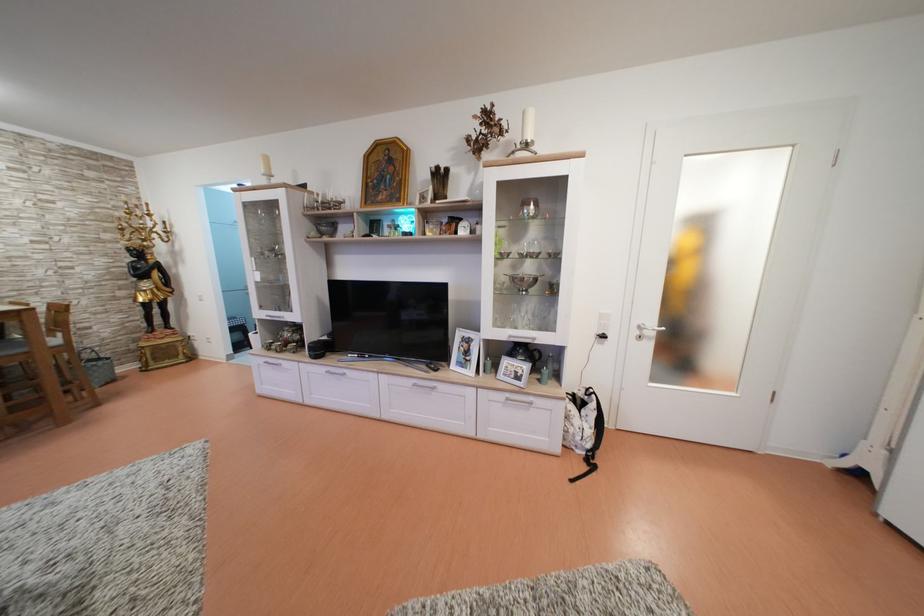
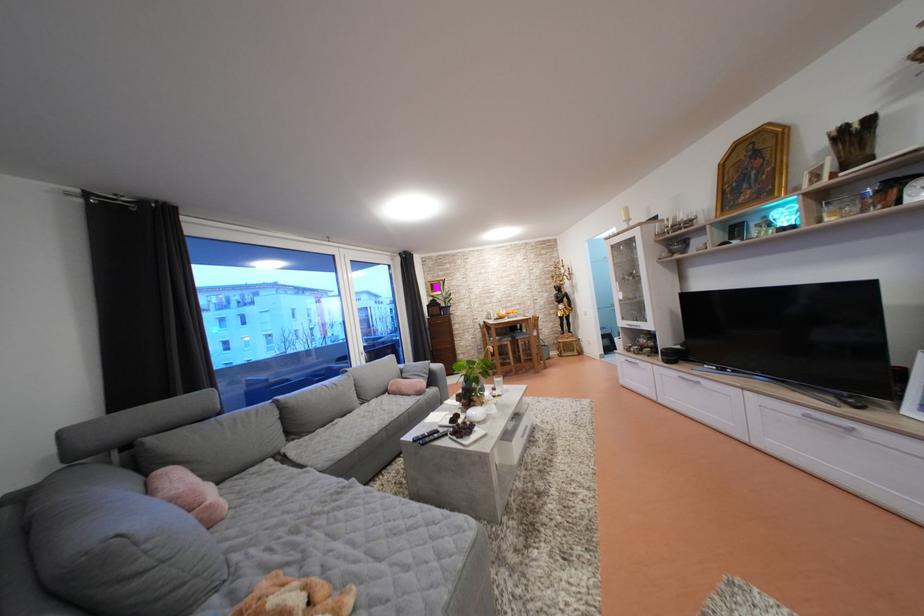
Question: The first image is from the beginning of the video and the second image is from the end. How did the camera likely rotate when shooting the video?

Choices:
 (A) Left
 (B) Right
 (C) Up
 (D) Down

Answer: (A)